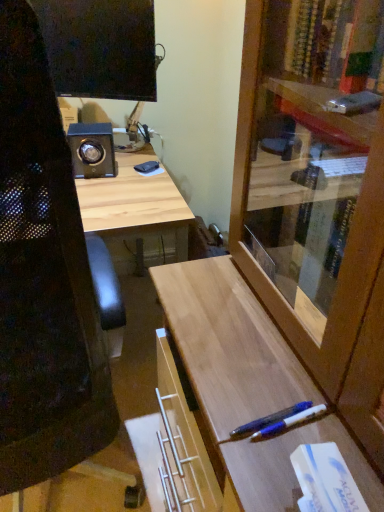
Describe the element at coordinates (312, 222) in the screenshot. I see `wooden cabinet at center-right` at that location.

You are a GUI agent. You are given a task and a screenshot of the screen. Output one action in this format:
    pyautogui.click(x=<x>, y=<y>)
    Task: Click on the translucent blue pen at lower right
    The image size is (384, 512).
    Given the screenshot: What is the action you would take?
    pyautogui.click(x=269, y=420)

Would you say white matte book at lower right is outside black mesh computer chair at left?

Absolutely, white matte book at lower right is external to black mesh computer chair at left.

Based on the photo, based on their sizes in the image, would you say white matte book at lower right is bigger or smaller than black mesh computer chair at left?

white matte book at lower right is smaller than black mesh computer chair at left.

How many degrees apart are the facing directions of white matte book at lower right and black mesh computer chair at left?

There is a 81.9-degree angle between the facing directions of white matte book at lower right and black mesh computer chair at left.

Is white matte book at lower right closer to the viewer compared to black mesh computer chair at left?

No, white matte book at lower right is further to the viewer.

Is black mesh computer chair at left not within translucent blue pen at lower right?

Indeed, black mesh computer chair at left is completely outside translucent blue pen at lower right.

Which object is further away from the camera taking this photo, black mesh computer chair at left or translucent blue pen at lower right?

translucent blue pen at lower right is behind.

From a real-world perspective, who is located higher, black mesh computer chair at left or translucent blue pen at lower right?

translucent blue pen at lower right is physically above.

Would you say black mesh computer chair at left is a long distance from translucent blue pen at lower right?

No.

Looking at their sizes, would you say wooden cabinet at center-right is wider or thinner than white matte book at lower right?

Considering their sizes, wooden cabinet at center-right looks broader than white matte book at lower right.

From the image's perspective, between wooden cabinet at center-right and white matte book at lower right, which one is located above?

wooden cabinet at center-right appears higher in the image.

Who is smaller, wooden cabinet at center-right or white matte book at lower right?

With smaller size is white matte book at lower right.

Is white matte book at lower right at the back of wooden cabinet at center-right?

No.

Does black mesh computer chair at left have a greater width compared to wooden cabinet at center-right?

Yes.

Between black mesh computer chair at left and wooden cabinet at center-right, which one has smaller size?

black mesh computer chair at left is smaller.

I want to click on cabinetry lying in front of the black mesh computer chair at left, so click(312, 222).

Consider the image. From the image's perspective, is black mesh computer chair at left above or below wooden cabinet at center-right?

black mesh computer chair at left is situated higher than wooden cabinet at center-right in the image.

Between translucent blue pen at lower right and white matte book at lower right, which one is positioned in front?

white matte book at lower right.

Is white matte book at lower right at the back of translucent blue pen at lower right?

That's not correct — translucent blue pen at lower right is not looking away from white matte book at lower right.

Does point (234, 432) lie behind point (351, 498)?

That is True.

From a real-world perspective, who is located higher, translucent blue pen at lower right or black mesh computer chair at left?

translucent blue pen at lower right, from a real-world perspective.

Considering the sizes of objects translucent blue pen at lower right and black mesh computer chair at left in the image provided, who is smaller, translucent blue pen at lower right or black mesh computer chair at left?

Smaller between the two is translucent blue pen at lower right.

Does point (250, 433) come farther from viewer compared to point (12, 217)?

Yes, point (250, 433) is behind point (12, 217).

How many degrees apart are the facing directions of translucent blue pen at lower right and black mesh computer chair at left?

translucent blue pen at lower right and black mesh computer chair at left are facing 93.9 degrees away from each other.

Is wooden cabinet at center-right not close to black mesh computer chair at left?

That's not correct — wooden cabinet at center-right is a little close to black mesh computer chair at left.

Which is behind, point (362, 174) or point (112, 430)?

Point (112, 430)

Can you confirm if wooden cabinet at center-right is thinner than black mesh computer chair at left?

Yes.

From a real-world perspective, is wooden cabinet at center-right physically above black mesh computer chair at left?

Indeed, from a real-world perspective, wooden cabinet at center-right stands above black mesh computer chair at left.

Where is `computer chair in front of the white matte book at lower right`? computer chair in front of the white matte book at lower right is located at coordinates (43, 279).

Locate an element on the screen. This screenshot has width=384, height=512. pen lying below the black mesh computer chair at left (from the image's perspective) is located at coordinates pyautogui.click(x=269, y=420).

Based on their spatial positions, is white matte book at lower right or wooden cabinet at center-right closer to translucent blue pen at lower right?

white matte book at lower right is positioned closer to the anchor translucent blue pen at lower right.

From the image, which object appears to be nearer to wooden cabinet at center-right, translucent blue pen at lower right or white matte book at lower right?

translucent blue pen at lower right is closer to wooden cabinet at center-right.

When comparing their distances from black mesh computer chair at left, does wooden cabinet at center-right or translucent blue pen at lower right seem closer?

translucent blue pen at lower right.

From the image, which object appears to be nearer to translucent blue pen at lower right, black mesh computer chair at left or white matte book at lower right?

Based on the image, white matte book at lower right appears to be nearer to translucent blue pen at lower right.

From the image, which object appears to be nearer to translucent blue pen at lower right, wooden cabinet at center-right or black mesh computer chair at left?

Based on the image, wooden cabinet at center-right appears to be nearer to translucent blue pen at lower right.

Based on their spatial positions, is black mesh computer chair at left or translucent blue pen at lower right closer to wooden cabinet at center-right?

The object closer to wooden cabinet at center-right is translucent blue pen at lower right.

Considering their positions, is translucent blue pen at lower right positioned closer to wooden cabinet at center-right than black mesh computer chair at left?

Based on the image, translucent blue pen at lower right appears to be nearer to wooden cabinet at center-right.

Looking at this image, looking at the image, which one is located closer to translucent blue pen at lower right, wooden cabinet at center-right or white matte book at lower right?

Based on the image, white matte book at lower right appears to be nearer to translucent blue pen at lower right.

You are a GUI agent. You are given a task and a screenshot of the screen. Output one action in this format:
    pyautogui.click(x=<x>, y=<y>)
    Task: Click on the book between black mesh computer chair at left and wooden cabinet at center-right in the horizontal direction
    
    Given the screenshot: What is the action you would take?
    pyautogui.click(x=326, y=478)

This screenshot has height=512, width=384. Find the location of `pen between black mesh computer chair at left and white matte book at lower right in the horizontal direction`. pen between black mesh computer chair at left and white matte book at lower right in the horizontal direction is located at coordinates (269, 420).

Locate an element on the screen. The height and width of the screenshot is (512, 384). book positioned between wooden cabinet at center-right and translucent blue pen at lower right from near to far is located at coordinates (326, 478).

Where is `pen between black mesh computer chair at left and wooden cabinet at center-right`? Image resolution: width=384 pixels, height=512 pixels. pen between black mesh computer chair at left and wooden cabinet at center-right is located at coordinates (269, 420).